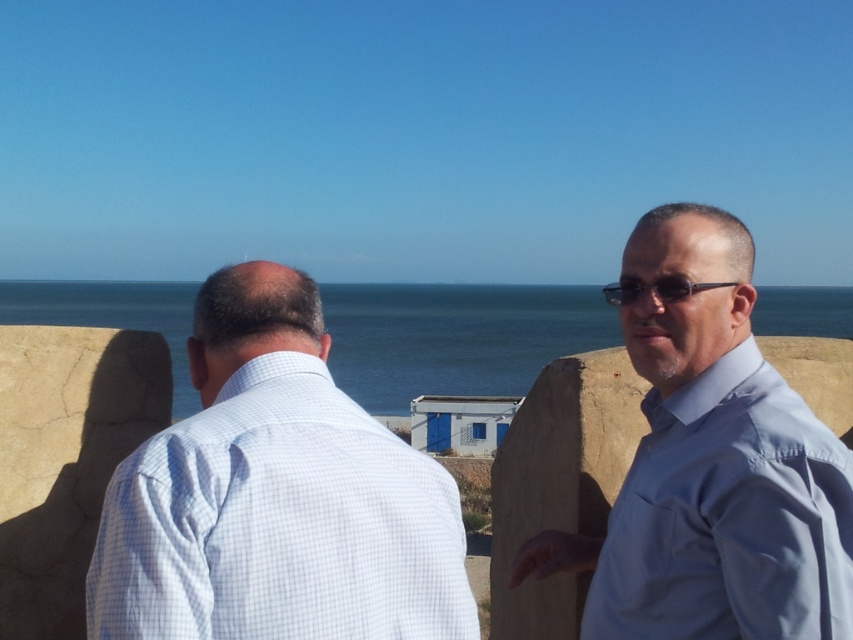
You are standing at the point with coordinates point (769, 310) and want to walk towards the point with coordinates point (227, 378). Given the scene described, will you have an unobstructed path to reach the second point?

The point (227, 378) is in front of point (769, 310), so yes, you will have an unobstructed path to reach the second point since it is positioned closer to you.

You are a photographer trying to capture a photo of the blue glossy shirt at right and the blue water at center. Which object would appear larger in the photo?

The blue water at center would appear larger in the photo because it is bigger than the blue glossy shirt at right.